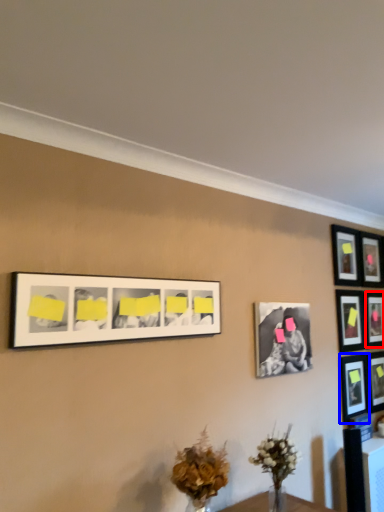
Question: Which of the following is the closest to the observer, picture frame (highlighted by a red box) or picture frame (highlighted by a blue box)?

Choices:
 (A) picture frame
 (B) picture frame

Answer: (B)